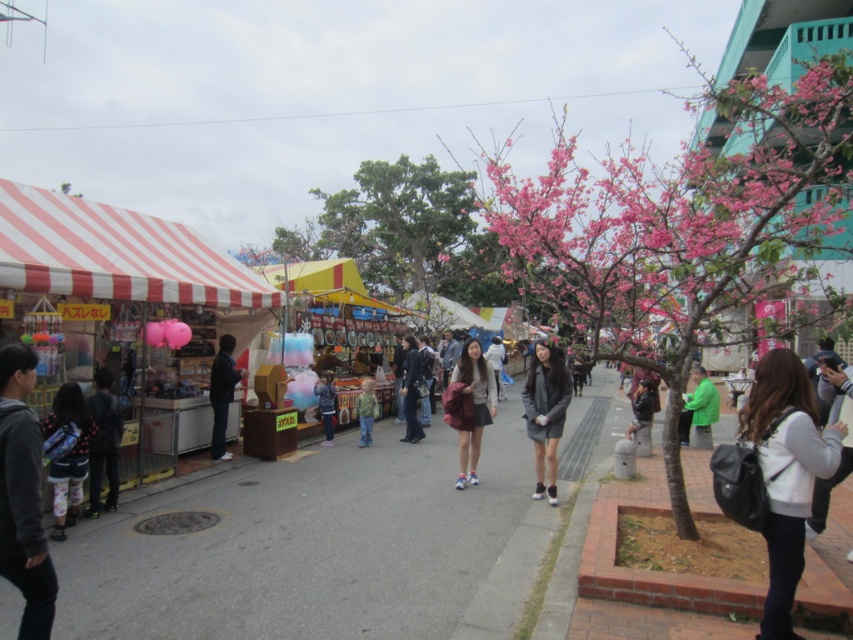
In the scene shown: Between gray asphalt at center and floral-patterned leggings at lower left, which one is positioned lower?

Positioned lower is gray asphalt at center.

What do you see at coordinates (320, 548) in the screenshot?
I see `gray asphalt at center` at bounding box center [320, 548].

Where is `gray asphalt at center`? This screenshot has width=853, height=640. gray asphalt at center is located at coordinates (320, 548).

Does green leafy tree at center appear under dark gray backpack at lower right?

Actually, green leafy tree at center is above dark gray backpack at lower right.

How much distance is there between green leafy tree at center and dark gray backpack at lower right?

green leafy tree at center and dark gray backpack at lower right are 73.19 feet apart from each other.

Who is more distant from viewer, (456, 202) or (639, 401)?

Point (456, 202)

Identify the location of green leafy tree at center. (405, 232).

Based on the photo, which of these two, red and white striped canopy at left or dark gray sweatshirt at lower left, stands taller?

Standing taller between the two is red and white striped canopy at left.

What do you see at coordinates (115, 253) in the screenshot? Image resolution: width=853 pixels, height=640 pixels. I see `red and white striped canopy at left` at bounding box center [115, 253].

Identify the location of red and white striped canopy at left. tap(115, 253).